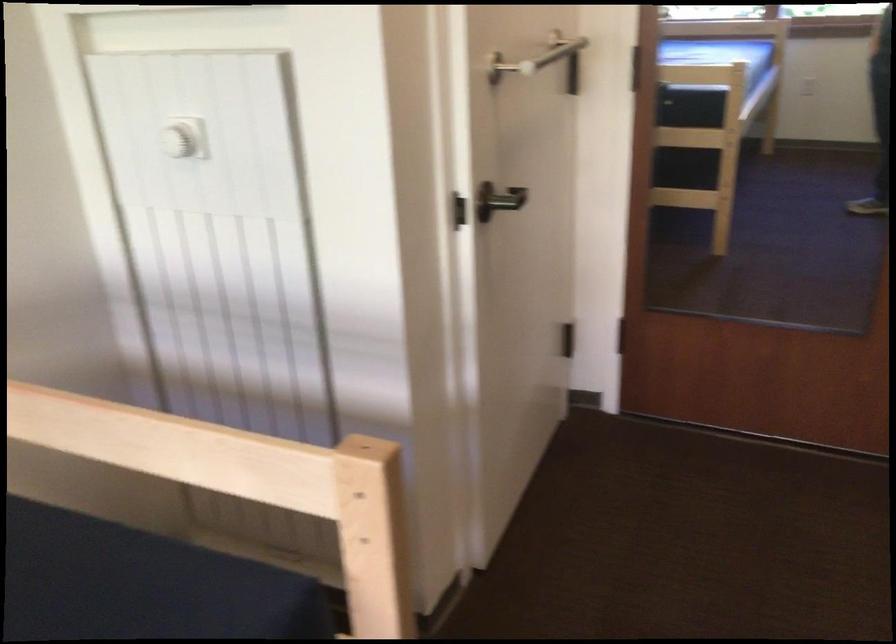
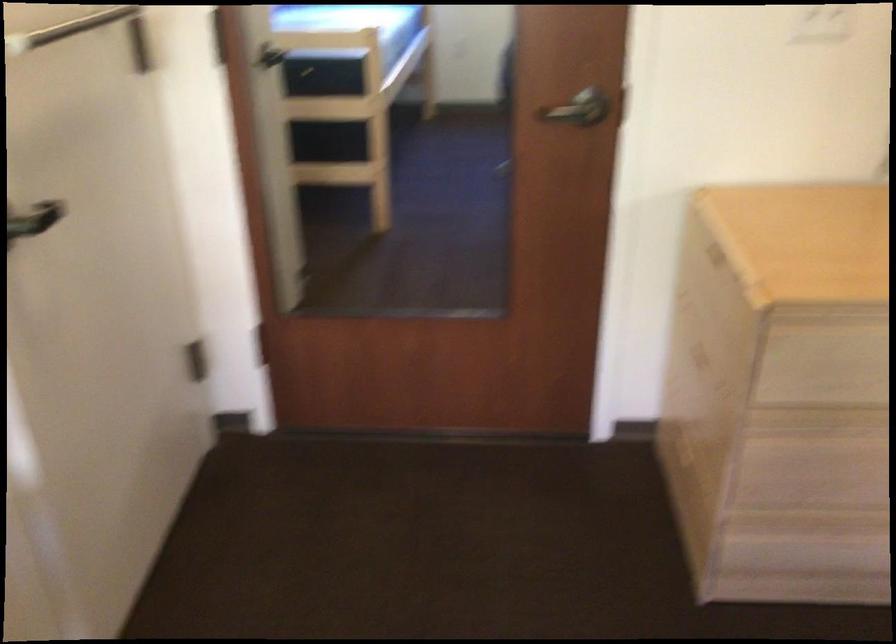
Find the pixel in the second image that matches (500,202) in the first image.

(35, 219)